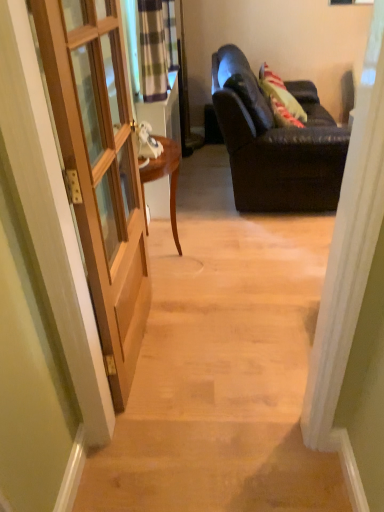
Question: From a real-world perspective, is dark brown leather couch at right positioned above or below wooden door at left?

Choices:
 (A) below
 (B) above

Answer: (B)

Question: Considering the positions of dark brown leather couch at right and wooden door at left in the image, is dark brown leather couch at right taller or shorter than wooden door at left?

Choices:
 (A) tall
 (B) short

Answer: (A)

Question: Considering the real-world distances, which object is closest to the wooden door at left?

Choices:
 (A) wooden door at left
 (B) plaid fabric curtain at upper left
 (C) dark brown leather couch at right

Answer: (A)

Question: Which is nearer to the wooden door at left?

Choices:
 (A) wooden door at left
 (B) plaid fabric curtain at upper left
 (C) dark brown leather couch at right

Answer: (A)